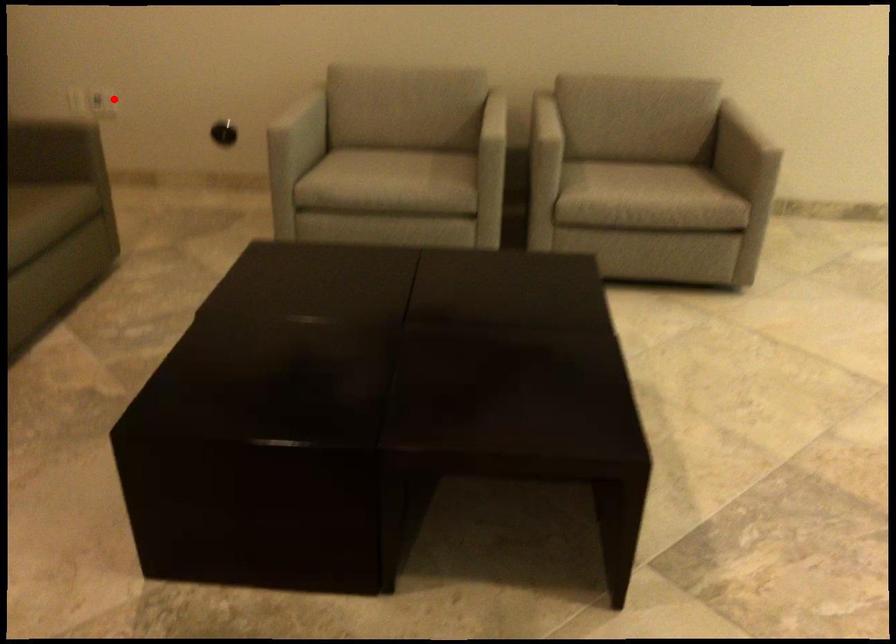
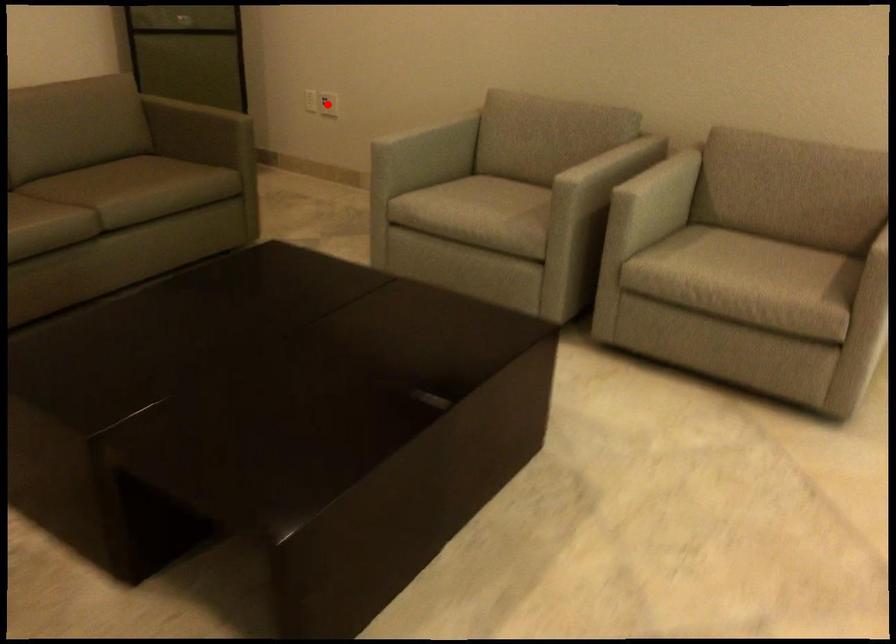
I am providing you with two images of the same scene from different viewpoints. A red point is marked on the first image and another point is marked on the second image. Is the marked point in image1 the same physical position as the marked point in image2?

Yes